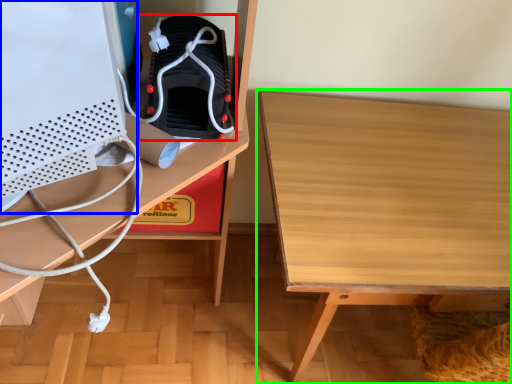
Question: Which is farther away from footwear (highlighted by a red box)? desktop computer (highlighted by a blue box) or table (highlighted by a green box)?

Choices:
 (A) desktop computer
 (B) table

Answer: (B)